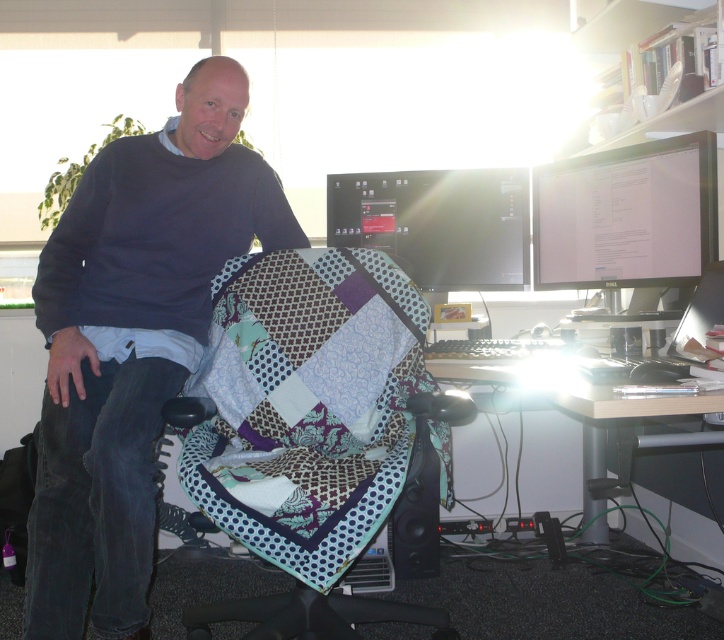
You are a delivery person who needs to place a package on the desk. The package is 5 feet long. Can you fit it on the desk between the man and the matte black monitor at upper right?

The distance between the man and the matte black monitor at upper right is 6.00 feet. Since the package is 5 feet long, it can fit between them as there is enough space.

What is the position of the dark blue sweater at center in the image?

The dark blue sweater at center is located at point (132,340).

You are standing in front of the desk setup and want to place a small object on the point that is closer to you. Which point should you choose between point (130, 600) and point (584, 468)?

Point (130, 600) is closer to the camera than point (584, 468), so you should choose point (130, 600) to place the small object.